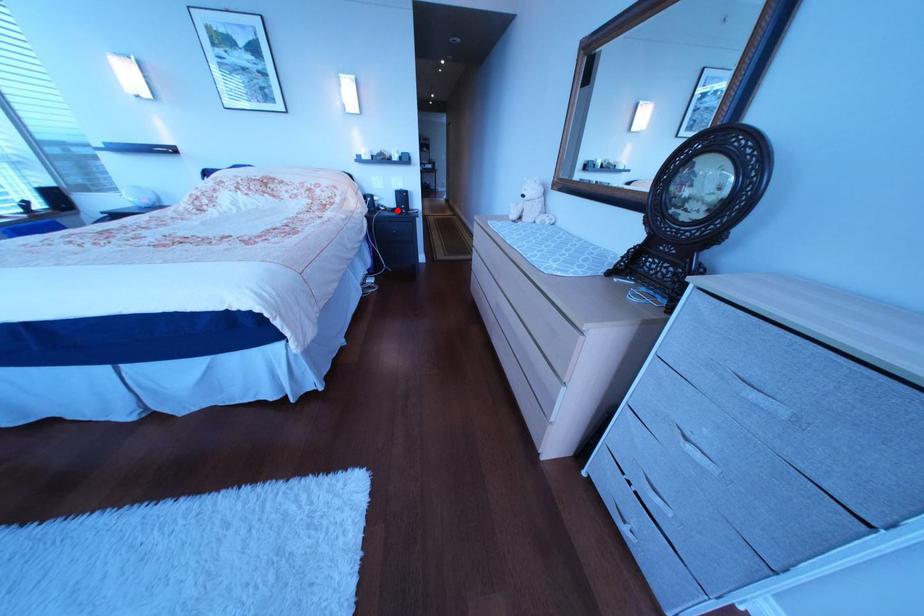
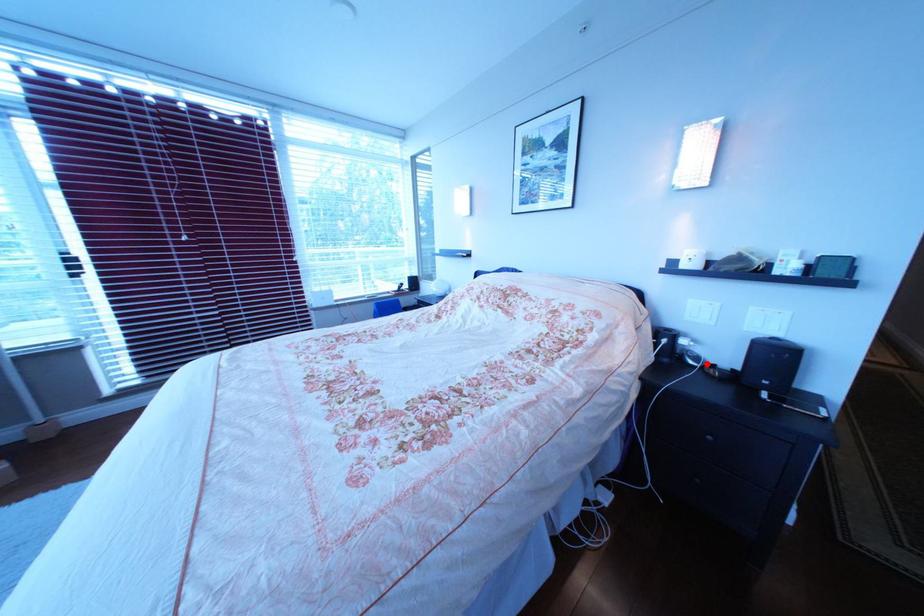
I am providing you with two images of the same scene from different viewpoints. A red point is marked on the first image and another point is marked on the second image. Does the point marked in image1 correspond to the same location as the one in image2?

Yes